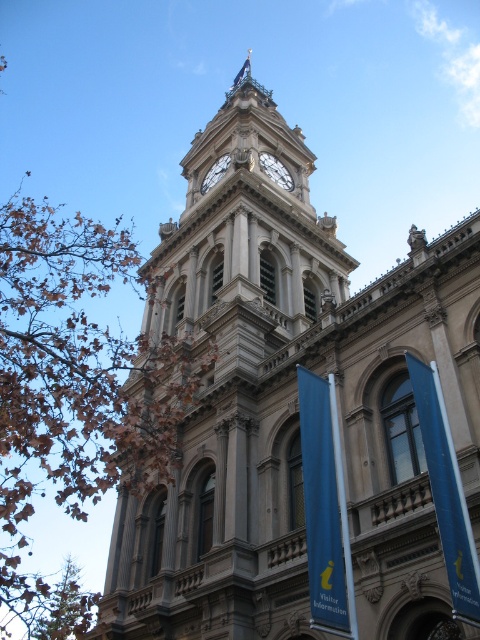
Question: Which object is the closest to the blue fabric flag at center?

Choices:
 (A) white stone clock at center
 (B) blue fabric flag at upper center
 (C) brown leafy tree at left

Answer: (A)

Question: Can you confirm if blue fabric flag at center is positioned below gold metallic clock at center?

Choices:
 (A) no
 (B) yes

Answer: (B)

Question: Does brown leafy tree at left appear under white stone clock at center?

Choices:
 (A) yes
 (B) no

Answer: (A)

Question: Which point is farther from the camera taking this photo?

Choices:
 (A) (48, 314)
 (B) (316, 392)

Answer: (A)

Question: Which object is closer to the camera taking this photo?

Choices:
 (A) gold metallic clock at center
 (B) blue fabric banner at center
 (C) blue fabric flag at center
 (D) blue fabric flag at upper center

Answer: (C)

Question: Where is blue fabric banner at center located in relation to gold metallic clock at center in the image?

Choices:
 (A) above
 (B) below

Answer: (B)